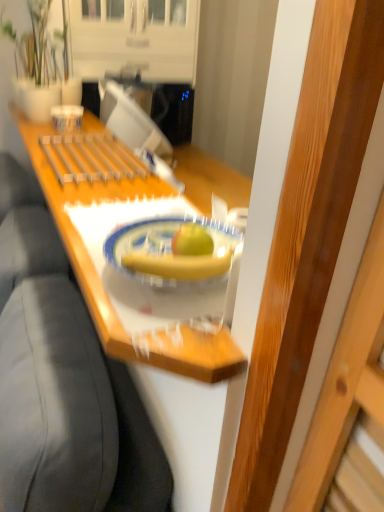
The width and height of the screenshot is (384, 512). I want to click on free location in front of porcelain plate at center, so click(x=169, y=328).